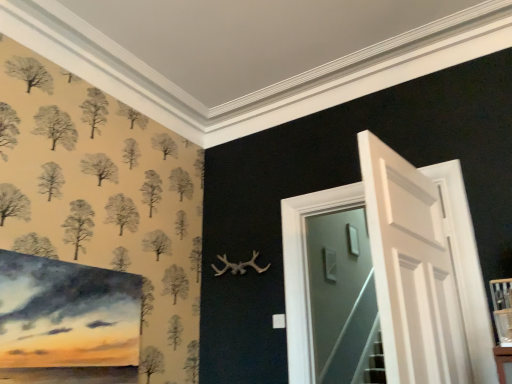
The width and height of the screenshot is (512, 384). What do you see at coordinates (401, 269) in the screenshot?
I see `white wooden door at center` at bounding box center [401, 269].

In order to click on white wooden door at center in this screenshot , I will do `click(401, 269)`.

Where is `white wooden door at center`? The image size is (512, 384). white wooden door at center is located at coordinates (401, 269).